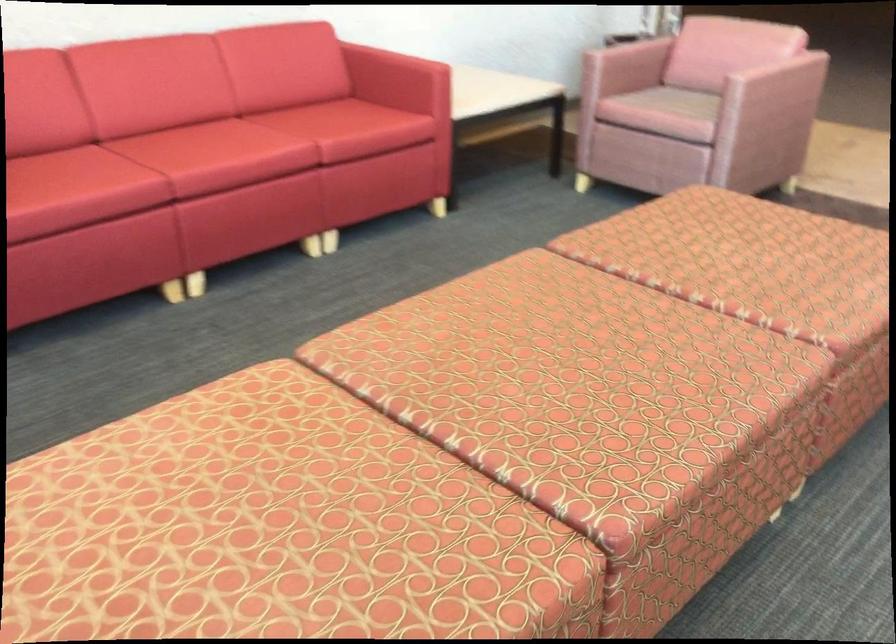
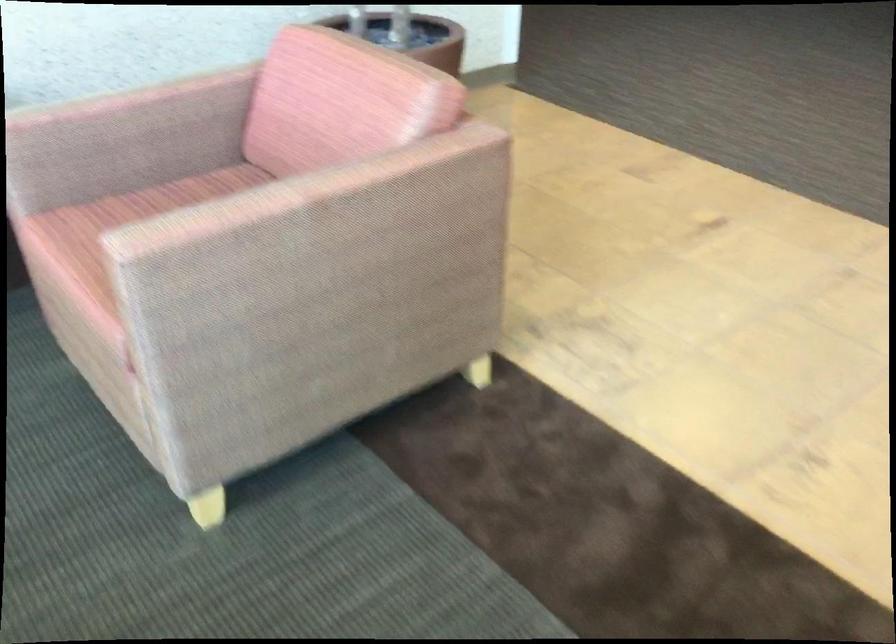
Question: I am providing you with two images of the same scene from different viewpoints. After the viewpoint changes to image2, which objects are now occluded?

Choices:
 (A) green rolled item
 (B) pink chair sitting surface
 (C) chair sitting surface
 (D) pink chair armrest

Answer: (C)